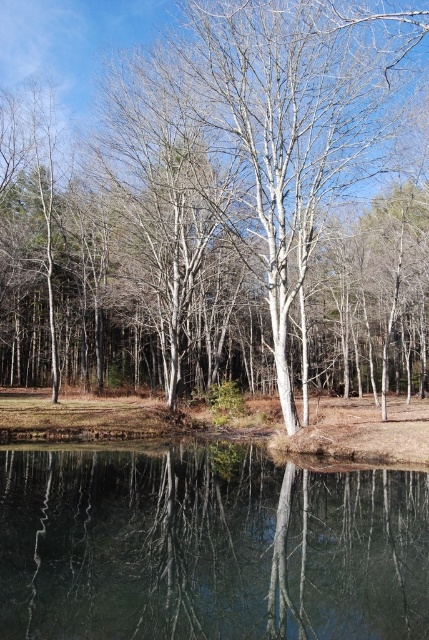
Question: Among these points, which one is farthest from the camera?

Choices:
 (A) (156, 609)
 (B) (389, 241)

Answer: (B)

Question: Which of the following is the farthest from the observer?

Choices:
 (A) clear glass water at center
 (B) smooth white tree at center

Answer: (B)

Question: Does smooth white tree at center appear over clear glass water at center?

Choices:
 (A) yes
 (B) no

Answer: (A)

Question: Is smooth white tree at center behind clear glass water at center?

Choices:
 (A) no
 (B) yes

Answer: (B)

Question: Is smooth white tree at center thinner than clear glass water at center?

Choices:
 (A) no
 (B) yes

Answer: (A)

Question: Which point is closer to the camera?

Choices:
 (A) smooth white tree at center
 (B) clear glass water at center

Answer: (B)